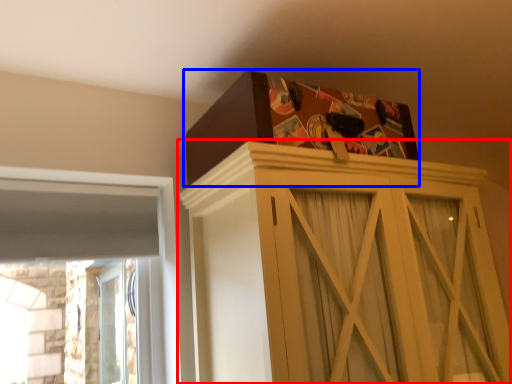
Question: Which of the following is the farthest to the observer, cupboard (highlighted by a red box) or cardboard box (highlighted by a blue box)?

Choices:
 (A) cupboard
 (B) cardboard box

Answer: (B)